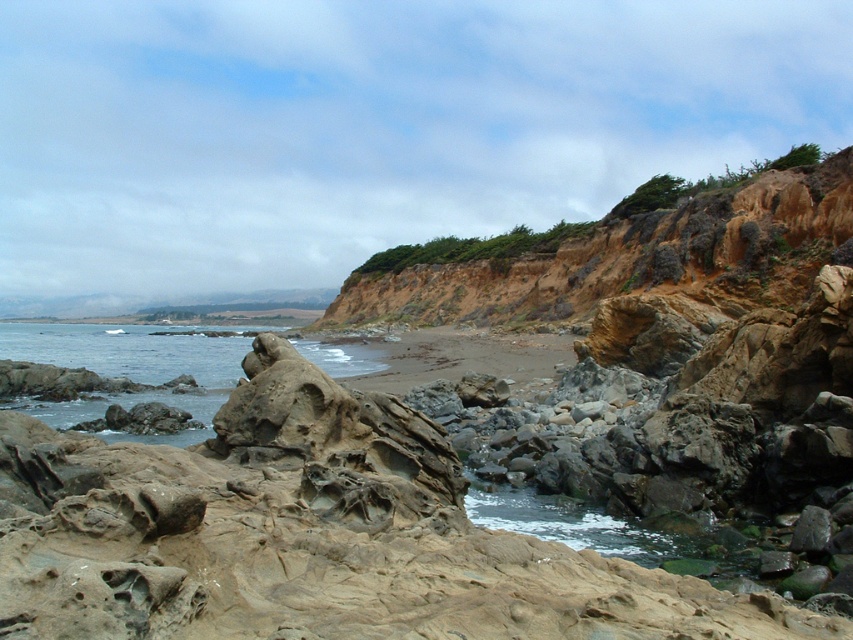
You are a hiker planning to cross from the brown rocky cliff at upper right to the clear water at center. Considering their sizes, which one would require more caution due to its smaller size?

The brown rocky cliff at upper right is smaller than the clear water at center, so it would require more caution due to its smaller size.

You are a hiker standing at the center of the coastal landscape. You want to take a photo of the brown rocky cliff at upper right. In which direction should you point your camera to capture it?

The brown rocky cliff at upper right is located at point [631,259] in 2D coordinates, so you should point your camera towards the upper right direction to capture it.